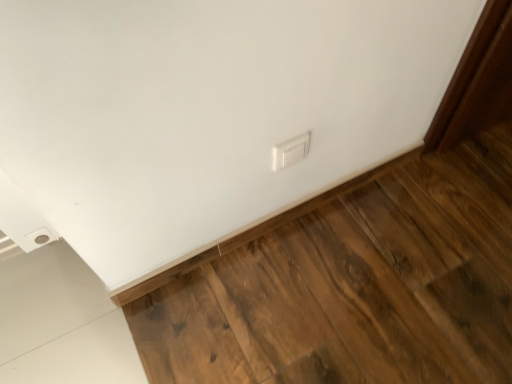
Question: Does point (502, 350) appear closer or farther from the camera than point (304, 134)?

Choices:
 (A) farther
 (B) closer

Answer: (A)

Question: From a real-world perspective, is brown wood flooring at lower right physically located above or below white plastic switch at center?

Choices:
 (A) above
 (B) below

Answer: (B)

Question: Is brown wood flooring at lower right to the left or to the right of white plastic switch at center in the image?

Choices:
 (A) right
 (B) left

Answer: (B)

Question: From the image's perspective, is white plastic switch at center positioned above or below brown wood flooring at lower right?

Choices:
 (A) above
 (B) below

Answer: (A)

Question: Is white plastic switch at center inside the boundaries of brown wood flooring at lower right, or outside?

Choices:
 (A) inside
 (B) outside

Answer: (B)

Question: In terms of size, does white plastic switch at center appear bigger or smaller than brown wood flooring at lower right?

Choices:
 (A) small
 (B) big

Answer: (A)

Question: Would you say white plastic switch at center is to the left or to the right of brown wood flooring at lower right in the picture?

Choices:
 (A) right
 (B) left

Answer: (A)